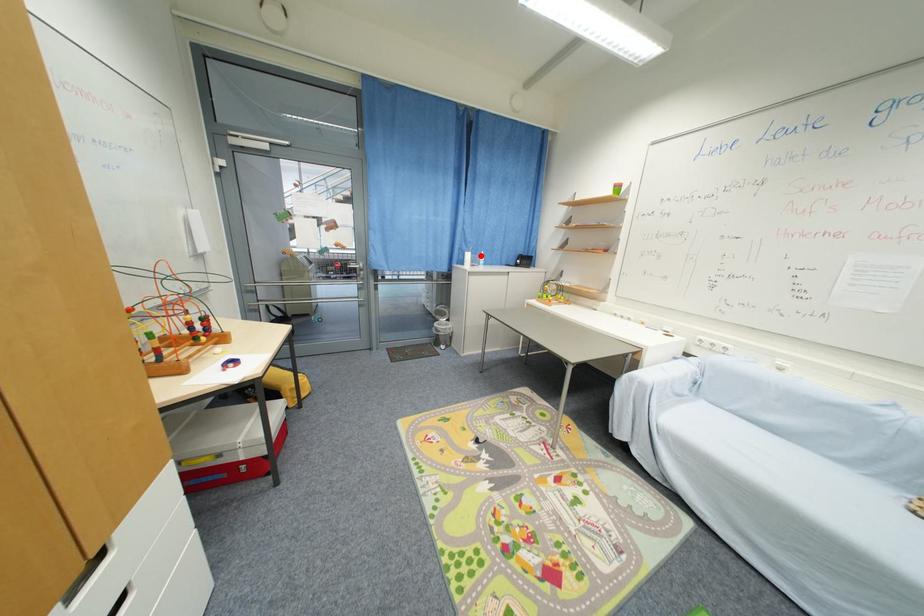
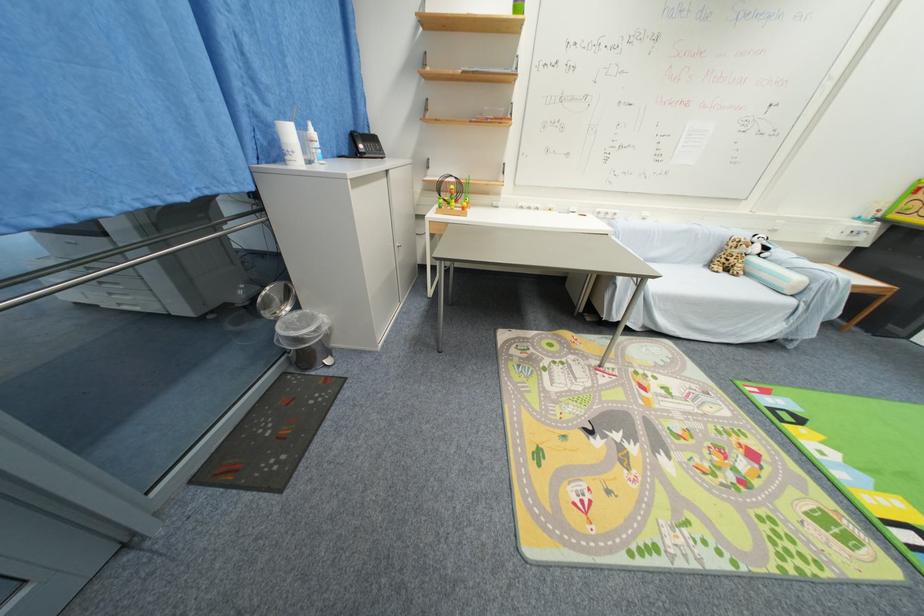
In the second image, find the point that corresponds to the highlighted location in the first image.

(306, 129)